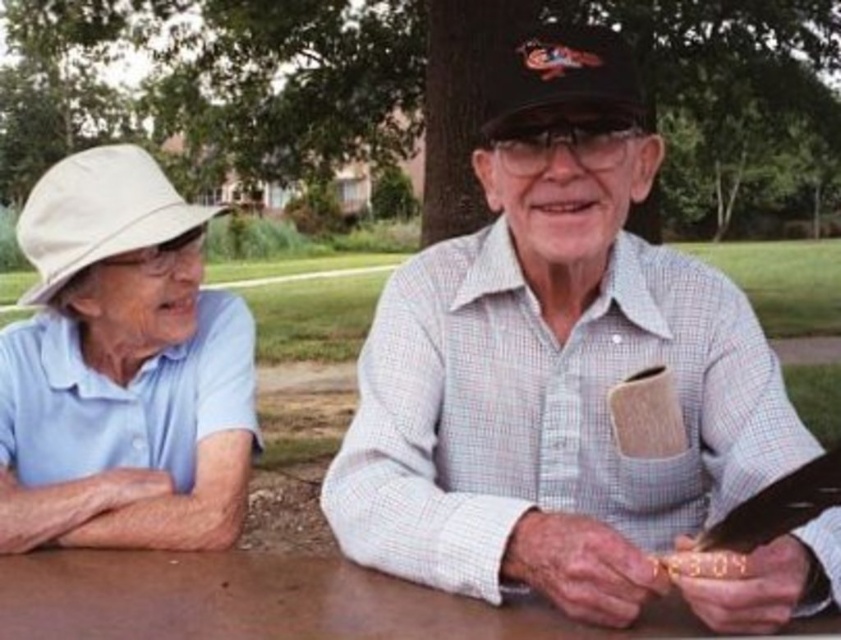
At what (x,y) coordinates should I click in order to perform the action: click on white fabric hat at left. Please return your answer as a coordinate pair (x, y). Looking at the image, I should click on (122, 369).

Is white fabric hat at left positioned behind black textured baseball cap at center?

That is True.

Find the location of a particular element. The image size is (841, 640). white fabric hat at left is located at coordinates (122, 369).

This screenshot has height=640, width=841. What are the coordinates of `white fabric hat at left` in the screenshot? It's located at (122, 369).

Is brown wooden table at center above black textured baseball cap at center?

No, brown wooden table at center is not above black textured baseball cap at center.

Can you confirm if brown wooden table at center is thinner than black textured baseball cap at center?

In fact, brown wooden table at center might be wider than black textured baseball cap at center.

Describe the element at coordinates (268, 602) in the screenshot. The height and width of the screenshot is (640, 841). I see `brown wooden table at center` at that location.

Locate an element on the screen. The width and height of the screenshot is (841, 640). brown wooden table at center is located at coordinates (268, 602).

Is point (341, 540) closer to camera compared to point (41, 486)?

Yes, it is in front of point (41, 486).

Who is shorter, white checkered shirt at center or white fabric hat at left?

white fabric hat at left

Between point (637, 499) and point (175, 369), which one is positioned behind?

Positioned behind is point (175, 369).

At what (x,y) coordinates should I click in order to perform the action: click on white checkered shirt at center. Please return your answer as a coordinate pair (x, y). Image resolution: width=841 pixels, height=640 pixels. Looking at the image, I should click on (569, 381).